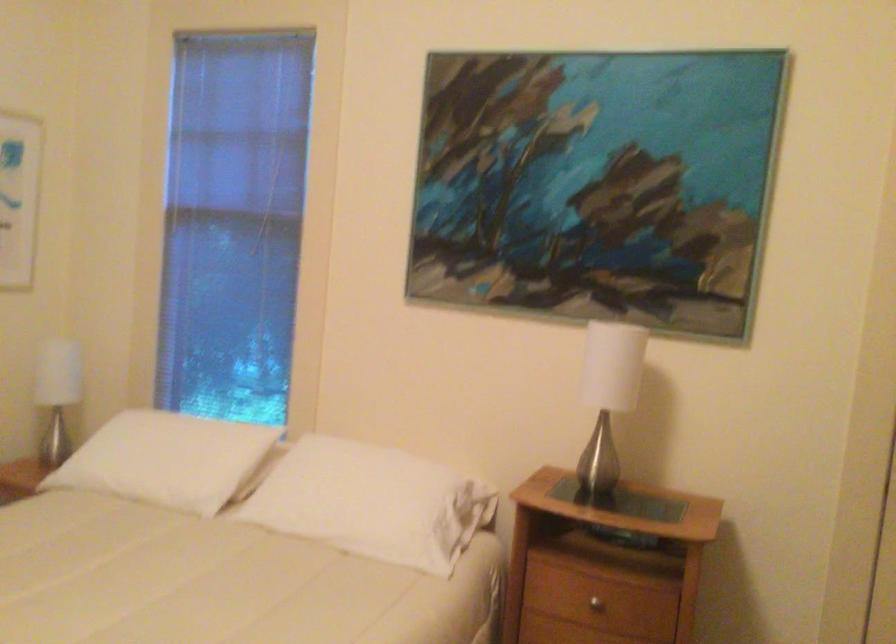
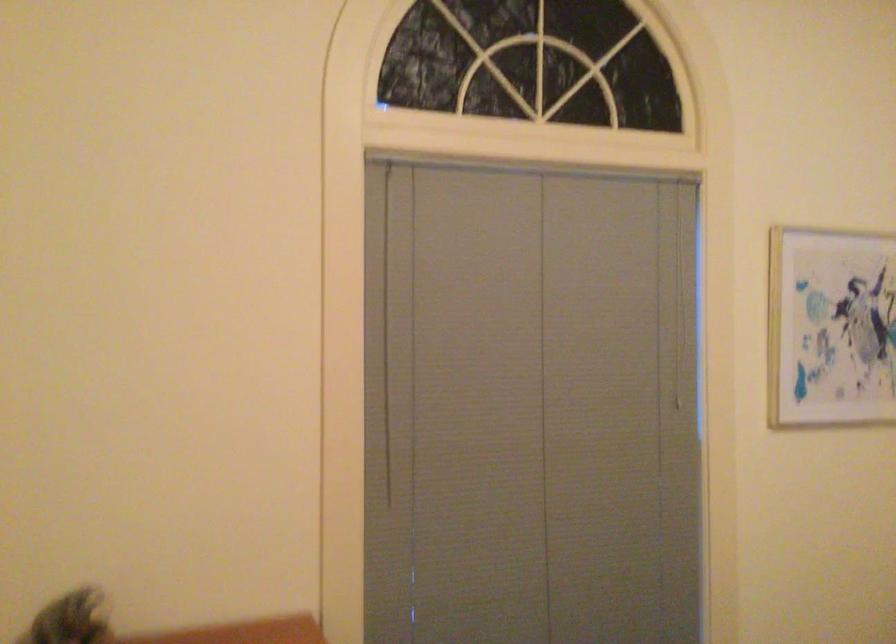
Question: The camera is either moving clockwise (left) or counter-clockwise (right) around the object. The first image is from the beginning of the video and the second image is from the end. Is the camera moving left or right when shooting the video?

Choices:
 (A) Left
 (B) Right

Answer: (B)